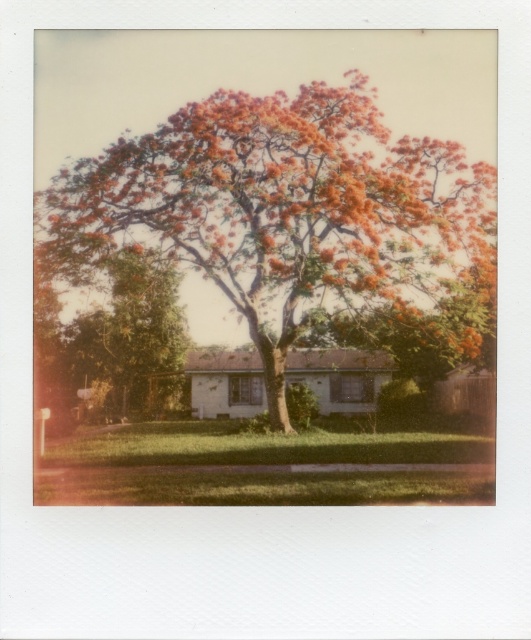
You are standing at the base of the tree with vibrant orange red blossoms and want to walk towards the house in the background. There are two points marked on the ground in front of you. The first point is at coordinate point (226, 96) and the second is at coordinate point (161, 301). Which point should you step on first to reach the house without going around the tree?

You should step on point (226, 96) first because it is in front of point (161, 301), meaning it is closer to the house and allows a direct path towards the house without needing to go around the tree.